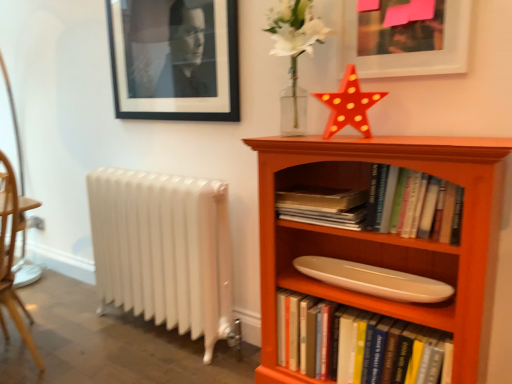
The height and width of the screenshot is (384, 512). In order to click on vacant space that's between wooden chair at left and white metallic radiator at lower left in this screenshot , I will do `click(89, 333)`.